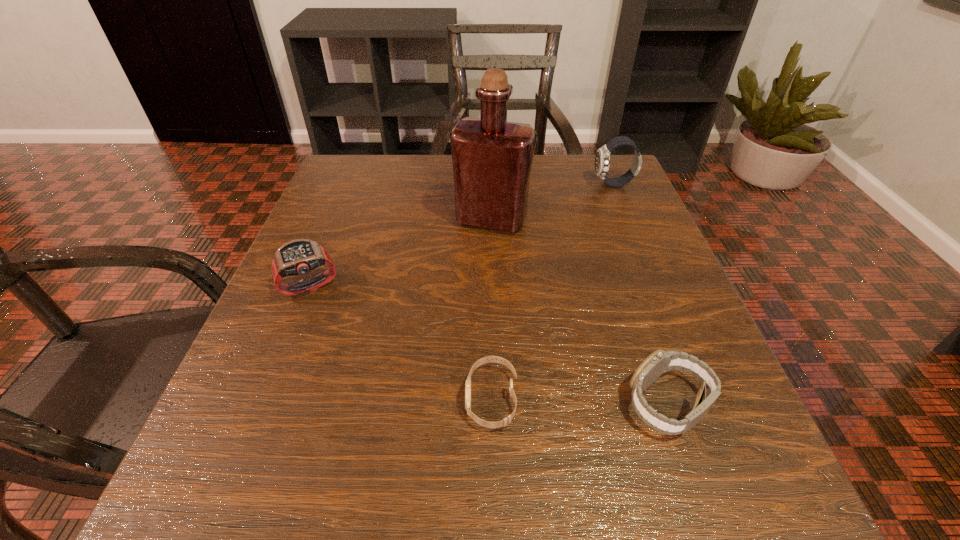
Identify the location of liquor. (492, 158).

Locate an element on the screen. The height and width of the screenshot is (540, 960). the second farthest object is located at coordinates (492, 158).

The image size is (960, 540). Find the location of `the farthest watch`. the farthest watch is located at coordinates (602, 160).

Where is `the tallest watch`? the tallest watch is located at coordinates (602, 160).

Identify the location of the leftmost object. This screenshot has width=960, height=540. (296, 257).

I want to click on the leftmost watch, so click(296, 257).

Identify the location of the shortest watch. (506, 421).

The width and height of the screenshot is (960, 540). I want to click on the shortest object, so click(506, 421).

Where is `vacant space situated on the left of the liquor`? Image resolution: width=960 pixels, height=540 pixels. vacant space situated on the left of the liquor is located at coordinates (344, 219).

Where is `free space located on the face of the fourth shortest object`? Image resolution: width=960 pixels, height=540 pixels. free space located on the face of the fourth shortest object is located at coordinates (516, 185).